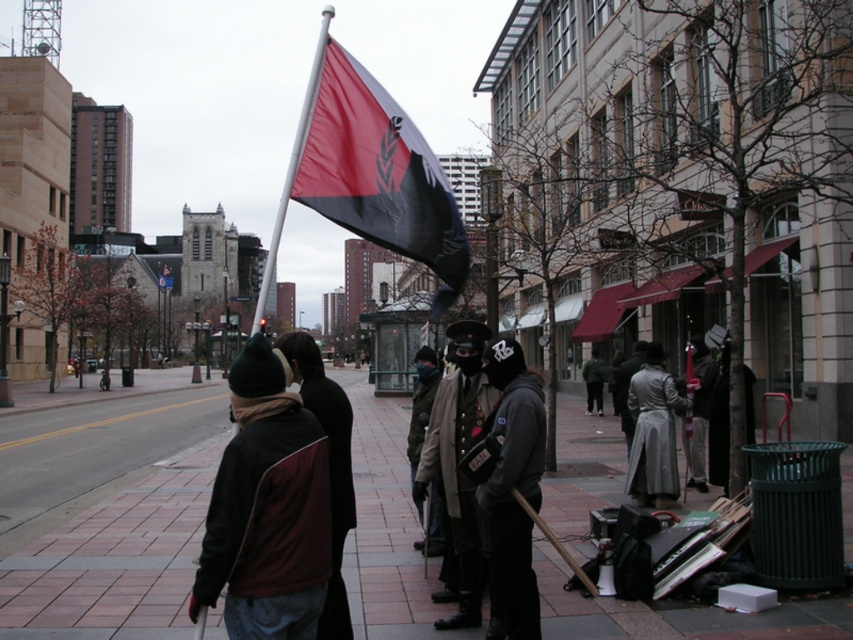
Question: Is black fabric beanie at center thinner than silver metallic coat at center?

Choices:
 (A) no
 (B) yes

Answer: (B)

Question: Can you confirm if paved brick sidewalk at center is wider than black matte flag at center?

Choices:
 (A) no
 (B) yes

Answer: (B)

Question: Which point appears closest to the camera in this image?

Choices:
 (A) (413, 221)
 (B) (670, 499)
 (C) (520, 477)
 (D) (341, 596)

Answer: (A)

Question: Can you confirm if black matte flag at center is wider than leather jacket at center?

Choices:
 (A) no
 (B) yes

Answer: (B)

Question: Which is nearer to the red and black jacket at center?

Choices:
 (A) black matte flag at center
 (B) silver metallic flag pole at upper center

Answer: (A)

Question: Estimate the real-world distances between objects in this image. Which object is closer to the silver metallic coat at center?

Choices:
 (A) black fabric beanie at center
 (B) silver metallic flag pole at upper center

Answer: (A)